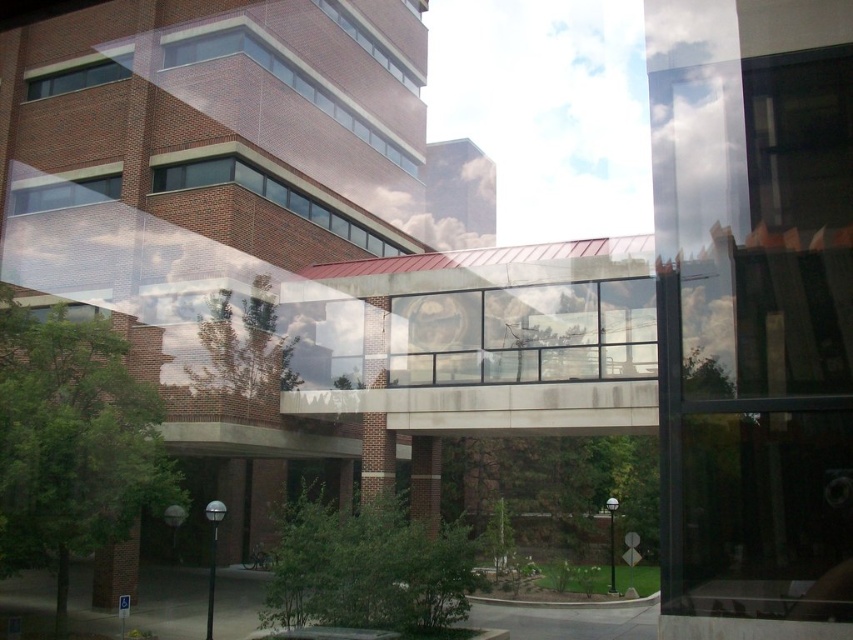
You are standing in front of the modern architectural scene shown. There is a point marked at coordinates (271, 196). What object does this point correspond to?

The point corresponds to the matte glass window at center.

You are an architect reviewing a building design. You need to determine the spatial relationship between the matte glass window at center and the clear glass window at upper left. Which window is positioned to the right of the other?

The matte glass window at center is positioned to the right of the clear glass window at upper left.